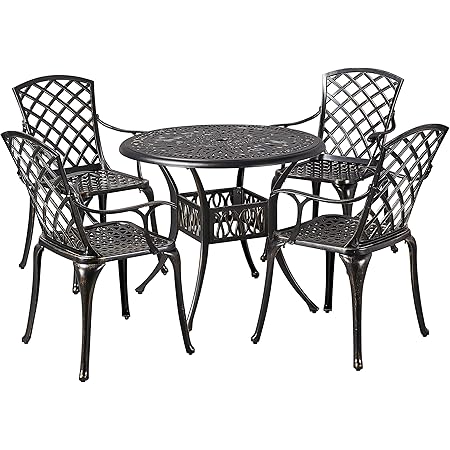
The image size is (450, 450). I want to click on top of table, so click(250, 138).